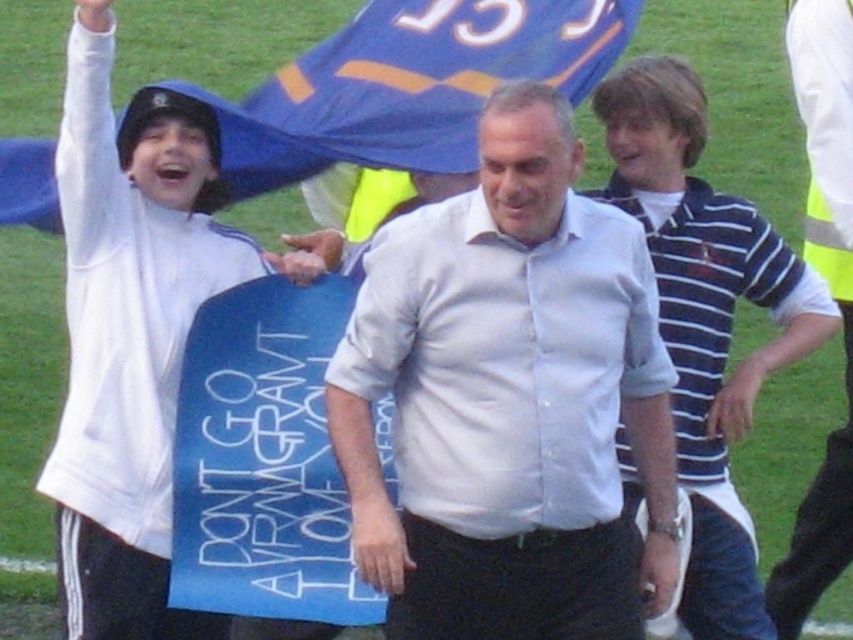
Which of these two, white matte jacket at left or blue fabric flag at upper center, stands shorter?

With less height is blue fabric flag at upper center.

Does white matte jacket at left appear on the right side of blue fabric flag at upper center?

No, white matte jacket at left is not to the right of blue fabric flag at upper center.

Measure the distance between point [259,632] and camera.

A distance of 26.07 feet exists between point [259,632] and camera.

You are a GUI agent. You are given a task and a screenshot of the screen. Output one action in this format:
    pyautogui.click(x=<x>, y=<y>)
    Task: Click on the white matte jacket at left
    Image resolution: width=853 pixels, height=640 pixels.
    Given the screenshot: What is the action you would take?
    pyautogui.click(x=135, y=339)

Is point (534, 476) positioned in front of point (134, 339)?

Yes, point (534, 476) is closer to viewer.

Between white cotton shirt at center and white matte jacket at left, which one has more height?

white matte jacket at left is taller.

At what (x,y) coordinates should I click in order to perform the action: click on white cotton shirt at center. Please return your answer as a coordinate pair (x, y). This screenshot has height=640, width=853. Looking at the image, I should click on (508, 400).

Find the location of a particular element. white cotton shirt at center is located at coordinates (508, 400).

Is blue striped polo shirt at center taller than blue fabric flag at upper center?

Correct, blue striped polo shirt at center is much taller as blue fabric flag at upper center.

Who is more forward, (659, 205) or (158, 86)?

Positioned in front is point (158, 86).

You are a GUI agent. You are given a task and a screenshot of the screen. Output one action in this format:
    pyautogui.click(x=<x>, y=<y>)
    Task: Click on the blue striped polo shirt at center
    The image size is (853, 640).
    Given the screenshot: What is the action you would take?
    pyautogui.click(x=706, y=320)